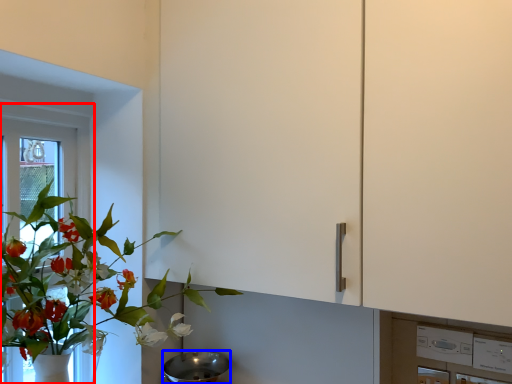
Question: Which of the following is the farthest to the observer, window frame (highlighted by a red box) or mixing bowl (highlighted by a blue box)?

Choices:
 (A) window frame
 (B) mixing bowl

Answer: (A)